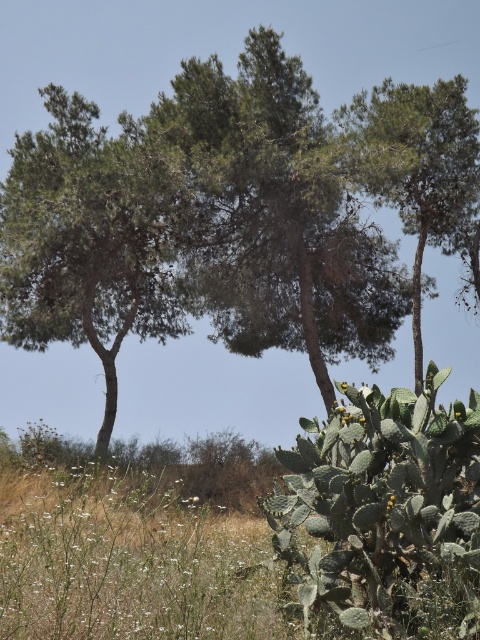
Question: Which point is closer to the camera?

Choices:
 (A) (397, 202)
 (B) (354, 342)

Answer: (A)

Question: Is green leafy tree at center to the left of green leafy tree at upper center from the viewer's perspective?

Choices:
 (A) yes
 (B) no

Answer: (A)

Question: Is green leafy tree at center below green leafy tree at upper center?

Choices:
 (A) yes
 (B) no

Answer: (A)

Question: Can you confirm if green leafy tree at center is positioned below green leafy tree at upper center?

Choices:
 (A) yes
 (B) no

Answer: (A)

Question: Which point appears farthest from the camera in this image?

Choices:
 (A) (386, 106)
 (B) (129, 412)

Answer: (B)